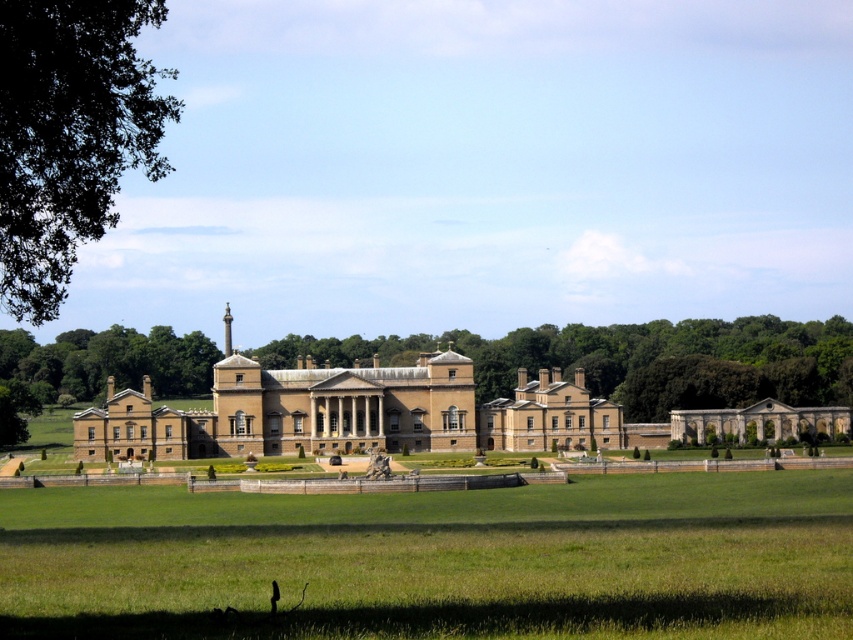
Question: Does green grass at center have a smaller size compared to green leafy tree at upper left?

Choices:
 (A) no
 (B) yes

Answer: (B)

Question: Can you confirm if green grass at center is thinner than green leafy tree at upper left?

Choices:
 (A) yes
 (B) no

Answer: (B)

Question: Which point appears closest to the camera in this image?

Choices:
 (A) (99, 161)
 (B) (538, 547)

Answer: (A)

Question: Can you confirm if green grass at center is positioned to the right of green leafy tree at upper left?

Choices:
 (A) no
 (B) yes

Answer: (B)

Question: Which object appears closest to the camera in this image?

Choices:
 (A) green leafy tree at upper left
 (B) green grass at center

Answer: (A)

Question: Which object is closer to the camera taking this photo?

Choices:
 (A) green leafy tree at upper left
 (B) green grass at center

Answer: (A)